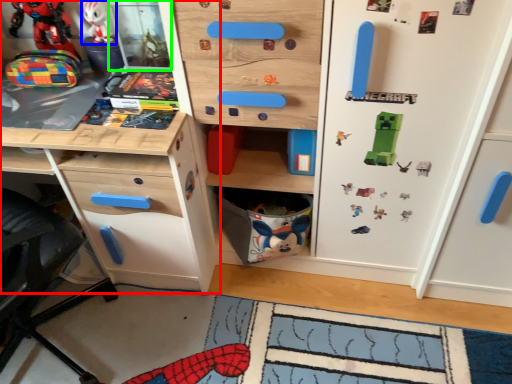
Question: Based on their relative distances, which object is farther from chest of drawers (highlighted by a red box)? Choose from toy (highlighted by a blue box) and shelf (highlighted by a green box).

Choices:
 (A) toy
 (B) shelf

Answer: (A)